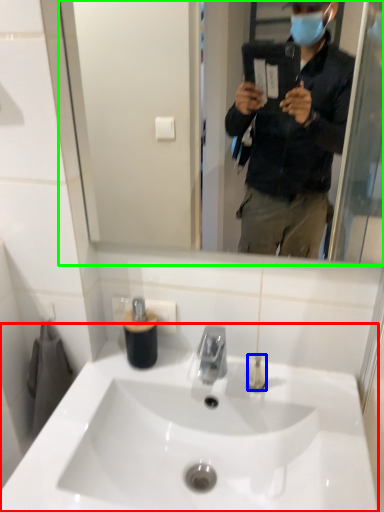
Question: Estimate the real-world distances between objects in this image. Which object is farther from sink (highlighted by a red box), toiletry (highlighted by a blue box) or mirror (highlighted by a green box)?

Choices:
 (A) toiletry
 (B) mirror

Answer: (B)